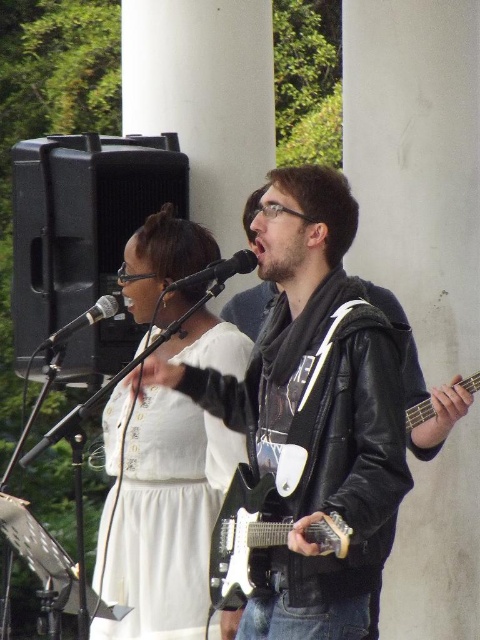
Is white satin dress at center shorter than black electric guitar at center?

No, white satin dress at center is not shorter than black electric guitar at center.

How much distance is there between white satin dress at center and black electric guitar at center?

A distance of 19.85 inches exists between white satin dress at center and black electric guitar at center.

Locate an element on the screen. white satin dress at center is located at coordinates (164, 518).

Can you confirm if white satin dress at center is positioned to the right of black matte microphone at center?

No, white satin dress at center is not to the right of black matte microphone at center.

Is point (129, 461) more distant than point (224, 266)?

Yes.

Describe the element at coordinates (164, 518) in the screenshot. The height and width of the screenshot is (640, 480). I see `white satin dress at center` at that location.

Identify the location of white satin dress at center. 164,518.

Does white satin dress at center have a lesser height compared to black metallic microphone at center?

Incorrect, white satin dress at center's height does not fall short of black metallic microphone at center's.

Can you confirm if white satin dress at center is smaller than black metallic microphone at center?

Incorrect, white satin dress at center is not smaller in size than black metallic microphone at center.

Image resolution: width=480 pixels, height=640 pixels. Describe the element at coordinates (164, 518) in the screenshot. I see `white satin dress at center` at that location.

Find the location of a particular element. white satin dress at center is located at coordinates (164, 518).